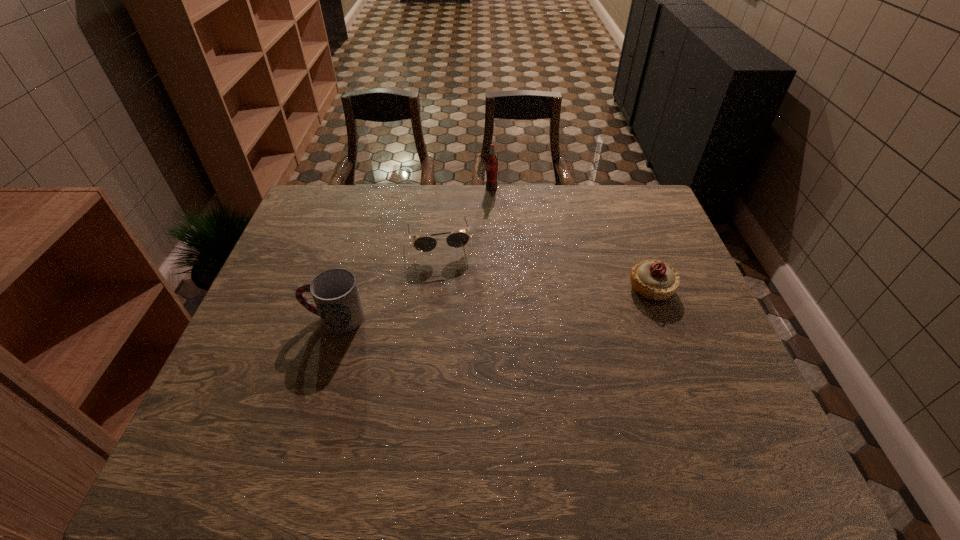
Identify the location of free location located on the back of the rightmost object. (619, 204).

The height and width of the screenshot is (540, 960). Identify the location of free space located 0.130m on the front lenses of the third nearest object. (451, 292).

Where is `free spot located on the front lenses of the third nearest object`? This screenshot has width=960, height=540. free spot located on the front lenses of the third nearest object is located at coordinates tap(461, 338).

The height and width of the screenshot is (540, 960). I want to click on vacant space located on the front lenses of the third nearest object, so click(450, 289).

What are the coordinates of `vacant space located on the label of the tallest object` in the screenshot? It's located at (491, 255).

This screenshot has width=960, height=540. In order to click on vacant space located on the label of the tallest object in this screenshot , I will do `click(492, 222)`.

You are a GUI agent. You are given a task and a screenshot of the screen. Output one action in this format:
    pyautogui.click(x=<x>, y=<y>)
    Task: Click on the free space located on the label of the tallest object
    This screenshot has height=540, width=960.
    Given the screenshot: What is the action you would take?
    pyautogui.click(x=492, y=230)

Locate an element on the screen. This screenshot has height=540, width=960. sunglasses that is at the far edge is located at coordinates (459, 239).

Locate an element on the screen. This screenshot has height=540, width=960. soda bottle present at the far edge is located at coordinates (492, 162).

Where is `object that is at the left edge`? Image resolution: width=960 pixels, height=540 pixels. object that is at the left edge is located at coordinates (335, 292).